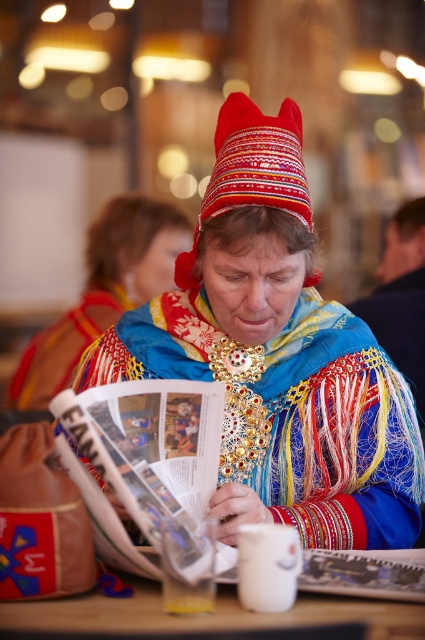
Question: Among these points, which one is nearest to the camera?

Choices:
 (A) (218, 172)
 (B) (152, 500)
 (C) (238, 369)

Answer: (B)

Question: Does multicolored woven scarf at center come behind printed paper magazine at center?

Choices:
 (A) yes
 (B) no

Answer: (A)

Question: Is printed paper magazine at center below embroidered felt hat at center?

Choices:
 (A) yes
 (B) no

Answer: (A)

Question: Which of the following is the closest to the observer?

Choices:
 (A) (184, 244)
 (B) (342, 604)
 (C) (413, 504)

Answer: (B)

Question: Does printed paper magazine at center have a greater width compared to wooden table at lower center?

Choices:
 (A) no
 (B) yes

Answer: (A)

Question: Which point is farther from the camera taking this photo?

Choices:
 (A) (292, 513)
 (B) (215, 445)
 (C) (45, 397)

Answer: (C)